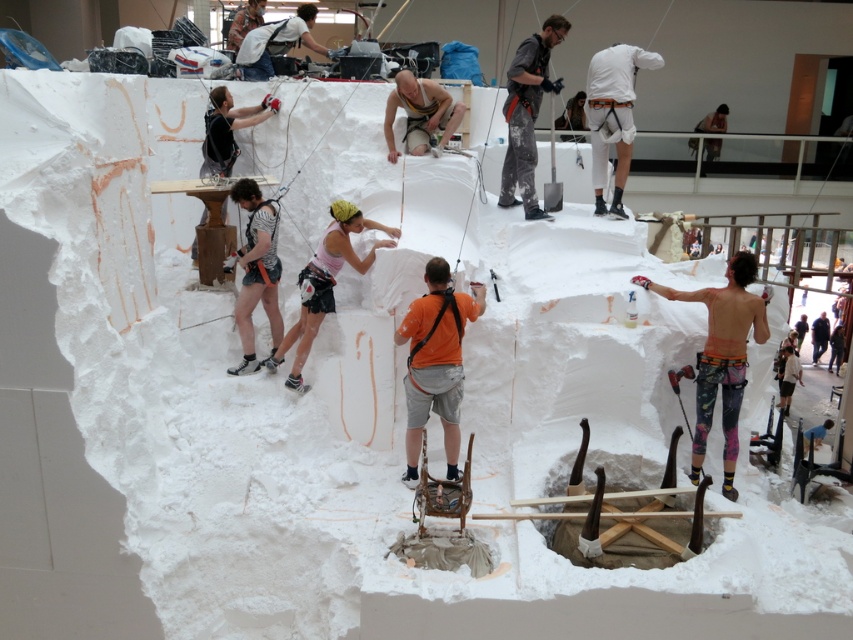
Is the position of multicolored leggings at right more distant than that of white matte shirt at upper right?

No, multicolored leggings at right is in front of white matte shirt at upper right.

Is point (711, 298) in front of point (590, 147)?

Yes, point (711, 298) is closer to viewer.

Find the location of a particular element. multicolored leggings at right is located at coordinates (721, 355).

Is multicolored leggings at right in front of pink fabric at center?

Yes, multicolored leggings at right is in front of pink fabric at center.

Is multicolored leggings at right to the left of pink fabric at center from the viewer's perspective?

No, multicolored leggings at right is not to the left of pink fabric at center.

Does point (741, 349) come in front of point (335, 259)?

That is True.

Locate an element on the screen. multicolored leggings at right is located at coordinates [x=721, y=355].

Is striped fabric shorts at center wider than matte yellow harness at center?

No.

Who is positioned more to the left, striped fabric shorts at center or matte yellow harness at center?

striped fabric shorts at center

Does point (247, 186) come behind point (405, 104)?

That is False.

Identify the location of striped fabric shorts at center. The image size is (853, 640). (x=256, y=272).